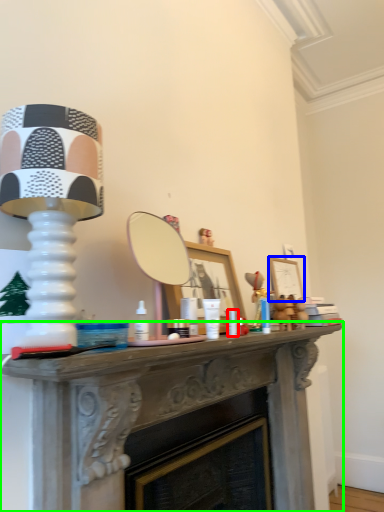
Question: Estimate the real-world distances between objects in this image. Which object is closer to toiletry (highlighted by a red box), picture frame (highlighted by a blue box) or table (highlighted by a green box)?

Choices:
 (A) picture frame
 (B) table

Answer: (B)